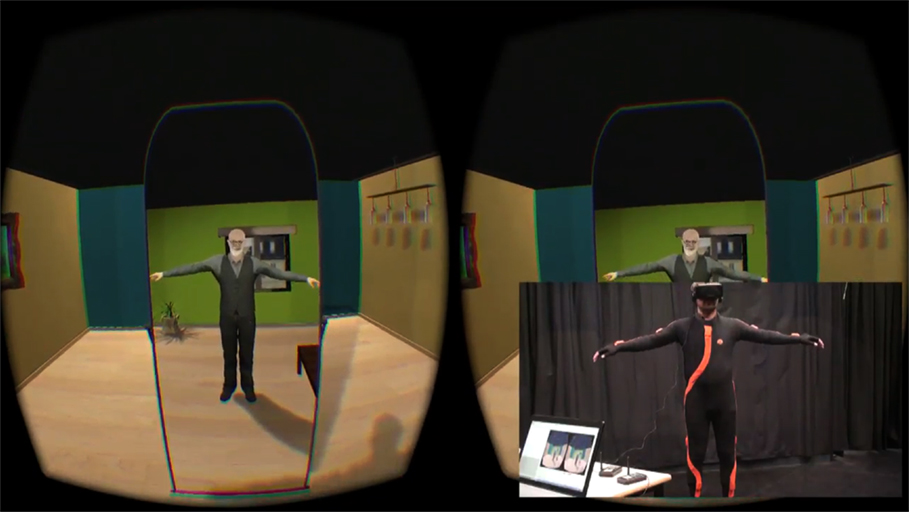
This screenshot has height=512, width=909. What are the coordinates of `floor in picture in picture image` in the screenshot? It's located at (801, 482).